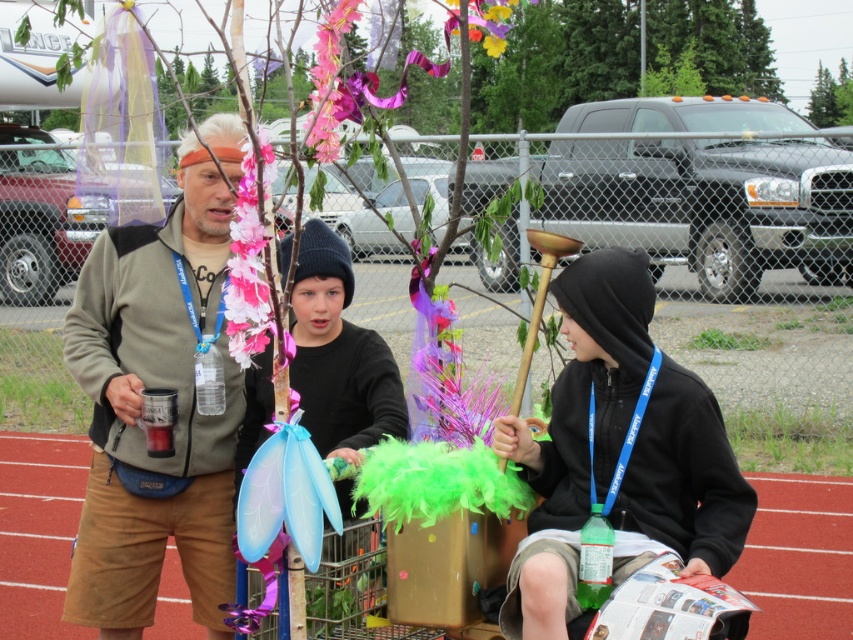
In the scene shown: You are a photographer at the community event and want to capture both the matte gray hoodie at center and the black matte jacket at center in a single photo. Which clothing item will appear larger in the photo?

The matte gray hoodie at center will appear larger in the photo because it is much taller than the black matte jacket at center.